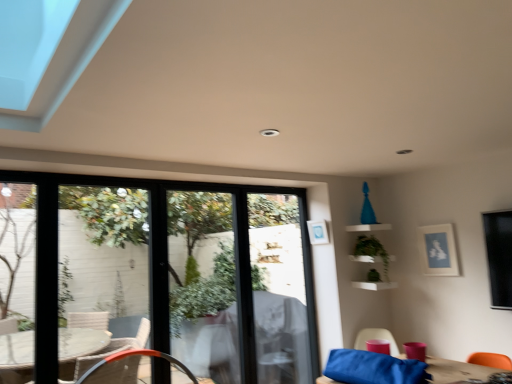
Image resolution: width=512 pixels, height=384 pixels. Describe the element at coordinates (243, 281) in the screenshot. I see `clear glass door at center` at that location.

The width and height of the screenshot is (512, 384). Describe the element at coordinates (318, 232) in the screenshot. I see `matte white picture frame at upper center, arranged as the 2th picture frame when viewed from the right` at that location.

You are a GUI agent. You are given a task and a screenshot of the screen. Output one action in this format:
    pyautogui.click(x=<x>, y=<y>)
    Task: Click on the matte pink cup at lower right, which is the first chair in right-to-left order
    This screenshot has height=384, width=512.
    Given the screenshot: What is the action you would take?
    pyautogui.click(x=376, y=338)

What do you see at coordinates (438, 250) in the screenshot? The image size is (512, 384). I see `matte blue picture frame at upper right, the first picture frame in the right-to-left sequence` at bounding box center [438, 250].

This screenshot has width=512, height=384. In order to click on white wicker chair at lower left, acting as the first chair starting from the left in this screenshot , I will do `click(135, 355)`.

Where is `clear glass door at center`? clear glass door at center is located at coordinates (243, 281).

Where is `the 2nd picture frame behind the transparent glass window at center, starting your count from the anchor`? Image resolution: width=512 pixels, height=384 pixels. the 2nd picture frame behind the transparent glass window at center, starting your count from the anchor is located at coordinates tap(318, 232).

Is transparent glass window at center positioned beyond the bounds of matte white picture frame at upper center, the first picture frame viewed from the left?

transparent glass window at center is positioned outside matte white picture frame at upper center, the first picture frame viewed from the left.

Could you tell me if transparent glass window at center is turned towards matte white picture frame at upper center, arranged as the 2th picture frame when viewed from the right?

Yes, transparent glass window at center is aimed at matte white picture frame at upper center, arranged as the 2th picture frame when viewed from the right.

Considering the positions of objects transparent glass window at center and matte white picture frame at upper center, the first picture frame viewed from the left, in the image provided, who is in front, transparent glass window at center or matte white picture frame at upper center, the first picture frame viewed from the left,?

transparent glass window at center is more forward.

Is green matte plant at upper right placed right next to transparent glass window at center?

They are not placed beside each other.

Which of these two, green matte plant at upper right or transparent glass window at center, is smaller?

green matte plant at upper right is smaller.

Is green matte plant at upper right oriented away from transparent glass window at center?

That's not correct — green matte plant at upper right is not looking away from transparent glass window at center.

Does white wicker chair at lower left, acting as the first chair starting from the left, have a lesser height compared to green matte plant at upper right?

Yes.

Looking at this image, which object is positioned more to the right, white wicker chair at lower left, the second chair in the right-to-left sequence, or green matte plant at upper right?

green matte plant at upper right is more to the right.

Choose the correct answer: Is white wicker chair at lower left, acting as the first chair starting from the left, inside green matte plant at upper right or outside it?

white wicker chair at lower left, acting as the first chair starting from the left, is not enclosed by green matte plant at upper right.

Based on the photo, could you tell me if white wicker chair at lower left, the second chair in the right-to-left sequence, is turned towards green matte plant at upper right?

No, white wicker chair at lower left, the second chair in the right-to-left sequence, is not oriented towards green matte plant at upper right.

Could you tell me if matte blue picture frame at upper right, the first picture frame in the right-to-left sequence, is turned towards green matte plant at upper right?

No, matte blue picture frame at upper right, the first picture frame in the right-to-left sequence, is not oriented towards green matte plant at upper right.

The image size is (512, 384). What are the coordinates of `the 1st picture frame positioned above the green matte plant at upper right (from the image's perspective)` in the screenshot? It's located at (438, 250).

Is matte blue picture frame at upper right, the second picture frame positioned from the left, not close to green matte plant at upper right?

matte blue picture frame at upper right, the second picture frame positioned from the left, is actually quite close to green matte plant at upper right.

Which of these two, matte blue picture frame at upper right, the first picture frame in the right-to-left sequence, or green matte plant at upper right, stands taller?

Standing taller between the two is green matte plant at upper right.

Are matte blue picture frame at upper right, the second picture frame positioned from the left, and matte white picture frame at upper center, arranged as the 2th picture frame when viewed from the right, located far from each other?

No, matte blue picture frame at upper right, the second picture frame positioned from the left, is in close proximity to matte white picture frame at upper center, arranged as the 2th picture frame when viewed from the right.

From a real-world perspective, which is physically above, matte blue picture frame at upper right, the second picture frame positioned from the left, or matte white picture frame at upper center, arranged as the 2th picture frame when viewed from the right?

In real-world perspective, matte white picture frame at upper center, arranged as the 2th picture frame when viewed from the right, is above.

Is matte blue picture frame at upper right, the first picture frame in the right-to-left sequence, thinner than matte white picture frame at upper center, the first picture frame viewed from the left?

Correct, the width of matte blue picture frame at upper right, the first picture frame in the right-to-left sequence, is less than that of matte white picture frame at upper center, the first picture frame viewed from the left.

Locate an element on the screen. Image resolution: width=512 pixels, height=384 pixels. picture frame below the matte white picture frame at upper center, arranged as the 2th picture frame when viewed from the right (from the image's perspective) is located at coordinates (438, 250).

In terms of width, does white wicker chair at lower left, acting as the first chair starting from the left, look wider or thinner when compared to matte white picture frame at upper center, the first picture frame viewed from the left?

Considering their sizes, white wicker chair at lower left, acting as the first chair starting from the left, looks broader than matte white picture frame at upper center, the first picture frame viewed from the left.

Does white wicker chair at lower left, the second chair in the right-to-left sequence, lie behind matte white picture frame at upper center, the first picture frame viewed from the left?

No, white wicker chair at lower left, the second chair in the right-to-left sequence, is closer to the viewer.

Is point (161, 357) closer or farther from the camera than point (312, 241)?

Point (161, 357) is positioned closer to the camera compared to point (312, 241).

Does point (64, 244) come in front of point (76, 381)?

No, (64, 244) is further to viewer.

From the image's perspective, is transparent glass window at center under white wicker chair at lower left, acting as the first chair starting from the left?

No.

Considering the relative sizes of transparent glass window at center and white wicker chair at lower left, acting as the first chair starting from the left, in the image provided, is transparent glass window at center taller than white wicker chair at lower left, acting as the first chair starting from the left,?

Correct, transparent glass window at center is much taller as white wicker chair at lower left, acting as the first chair starting from the left.

From a real-world perspective, is transparent glass window at center on white wicker chair at lower left, acting as the first chair starting from the left?

Yes, from a real-world perspective, transparent glass window at center is on top of white wicker chair at lower left, acting as the first chair starting from the left.

From a real-world perspective, count 2nd picture frames upward from the transparent glass window at center and point to it. Please provide its 2D coordinates.

[(318, 232)]

At what (x,y) coordinates should I click in order to perform the action: click on window on the left side of green matte plant at upper right. Please return your answer as a coordinate pair (x, y). This screenshot has height=384, width=512. Looking at the image, I should click on (175, 273).

Looking at the image, which one is located further to matte pink cup at lower right, the 2th chair from the left, matte blue picture frame at upper right, the first picture frame in the right-to-left sequence, or white wicker chair at lower left, acting as the first chair starting from the left?

white wicker chair at lower left, acting as the first chair starting from the left, is positioned further to the anchor matte pink cup at lower right, the 2th chair from the left.

Considering their positions, is green matte plant at upper right positioned further to matte white picture frame at upper center, arranged as the 2th picture frame when viewed from the right, than transparent glass window at center?

transparent glass window at center.

Considering their positions, is green matte plant at upper right positioned further to matte pink cup at lower right, which is the first chair in right-to-left order, than clear glass door at center?

The object further to matte pink cup at lower right, which is the first chair in right-to-left order, is clear glass door at center.

Based on their spatial positions, is matte blue picture frame at upper right, the first picture frame in the right-to-left sequence, or clear glass door at center closer to white wicker chair at lower left, the second chair in the right-to-left sequence?

Among the two, clear glass door at center is located nearer to white wicker chair at lower left, the second chair in the right-to-left sequence.

From the picture: Which object lies nearer to the anchor point clear glass door at center, green matte plant at upper right or white wicker chair at lower left, the second chair in the right-to-left sequence?

white wicker chair at lower left, the second chair in the right-to-left sequence, is positioned closer to the anchor clear glass door at center.

Considering their positions, is transparent glass window at center positioned further to matte pink cup at lower right, which is the first chair in right-to-left order, than green matte plant at upper right?

The object further to matte pink cup at lower right, which is the first chair in right-to-left order, is transparent glass window at center.

Estimate the real-world distances between objects in this image. Which object is closer to matte white picture frame at upper center, arranged as the 2th picture frame when viewed from the right, matte pink cup at lower right, the 2th chair from the left, or white wicker chair at lower left, acting as the first chair starting from the left?

matte pink cup at lower right, the 2th chair from the left, is positioned closer to the anchor matte white picture frame at upper center, arranged as the 2th picture frame when viewed from the right.

Which object lies nearer to the anchor point green matte plant at upper right, matte blue picture frame at upper right, the second picture frame positioned from the left, or matte pink cup at lower right, the 2th chair from the left?

Among the two, matte blue picture frame at upper right, the second picture frame positioned from the left, is located nearer to green matte plant at upper right.

I want to click on plant between clear glass door at center and matte blue picture frame at upper right, the second picture frame positioned from the left, from left to right, so click(371, 252).

Identify the location of picture frame located between clear glass door at center and green matte plant at upper right in the left-right direction. (318, 232).

Where is `picture frame between transparent glass window at center and matte blue picture frame at upper right, the first picture frame in the right-to-left sequence, from left to right`? This screenshot has width=512, height=384. picture frame between transparent glass window at center and matte blue picture frame at upper right, the first picture frame in the right-to-left sequence, from left to right is located at coordinates (318, 232).

You are a GUI agent. You are given a task and a screenshot of the screen. Output one action in this format:
    pyautogui.click(x=<x>, y=<y>)
    Task: Click on the screen door between transparent glass window at center and matte blue picture frame at upper right, the second picture frame positioned from the left, from left to right
    
    Given the screenshot: What is the action you would take?
    pyautogui.click(x=243, y=281)